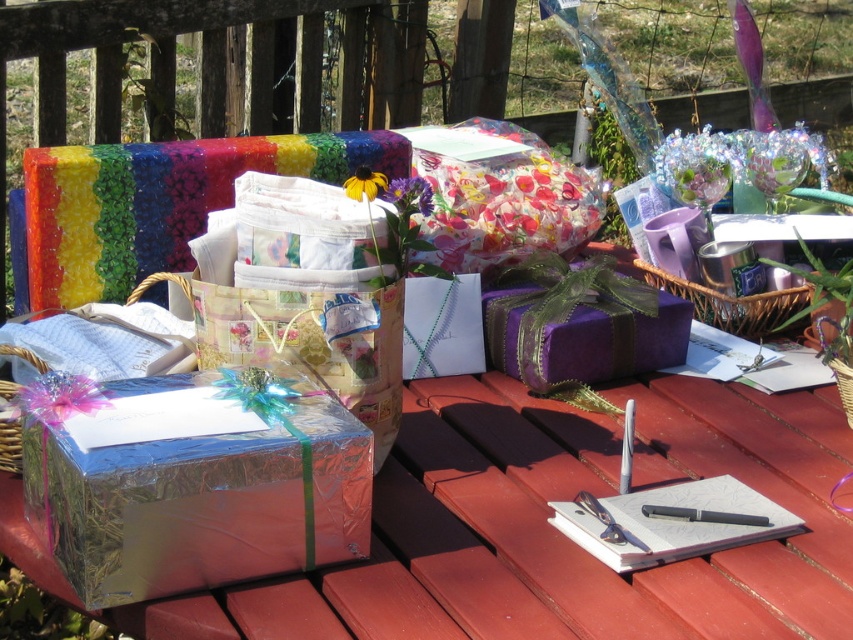
Which is above, purple satin gift at center or black plastic pen at center?

purple satin gift at center is above.

Who is more forward, (515, 346) or (689, 508)?

Positioned in front is point (689, 508).

The image size is (853, 640). Find the location of `purple satin gift at center`. purple satin gift at center is located at coordinates (579, 324).

Is translucent purple ribbon at lower left below woven brown basket at lower right?

Indeed, translucent purple ribbon at lower left is positioned under woven brown basket at lower right.

Who is taller, translucent purple ribbon at lower left or woven brown basket at lower right?

With more height is woven brown basket at lower right.

Measure the distance between point (64,374) and camera.

Point (64,374) and camera are 84.96 centimeters apart.

Find the location of a particular element. The width and height of the screenshot is (853, 640). translucent purple ribbon at lower left is located at coordinates (59, 397).

Does shiny metallic gift box at lower left have a lesser height compared to black plastic pen at center?

No.

Who is taller, shiny metallic gift box at lower left or black plastic pen at center?

With more height is shiny metallic gift box at lower left.

Where is `shiny metallic gift box at lower left`? The width and height of the screenshot is (853, 640). shiny metallic gift box at lower left is located at coordinates (192, 480).

Image resolution: width=853 pixels, height=640 pixels. In order to click on shiny metallic gift box at lower left in this screenshot , I will do `click(192, 480)`.